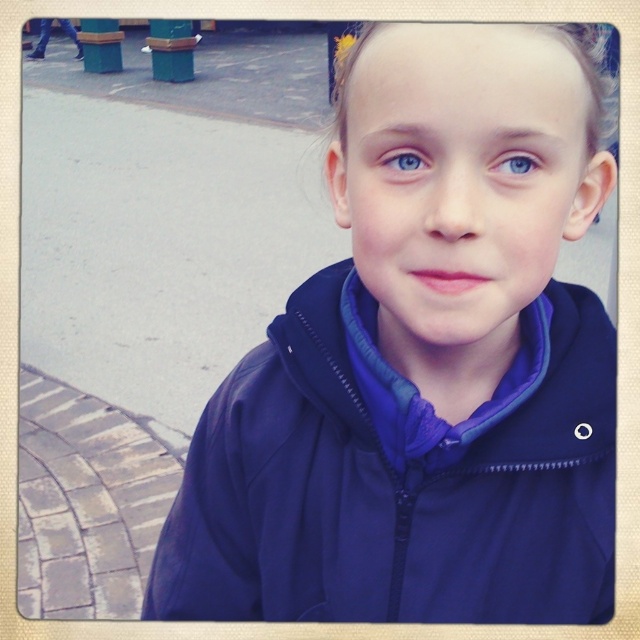
Based on the scene description, can you determine which object is positioned lower in the image between the dark blue jacket at center and the blue matte eye at center?

The dark blue jacket at center is located below the blue matte eye at center, so the dark blue jacket at center is positioned lower in the image.

Based on the scene description, which object has a greater width between the dark blue jacket at center and the blue matte eye at center?

The dark blue jacket at center has a greater width than the blue matte eye at center.